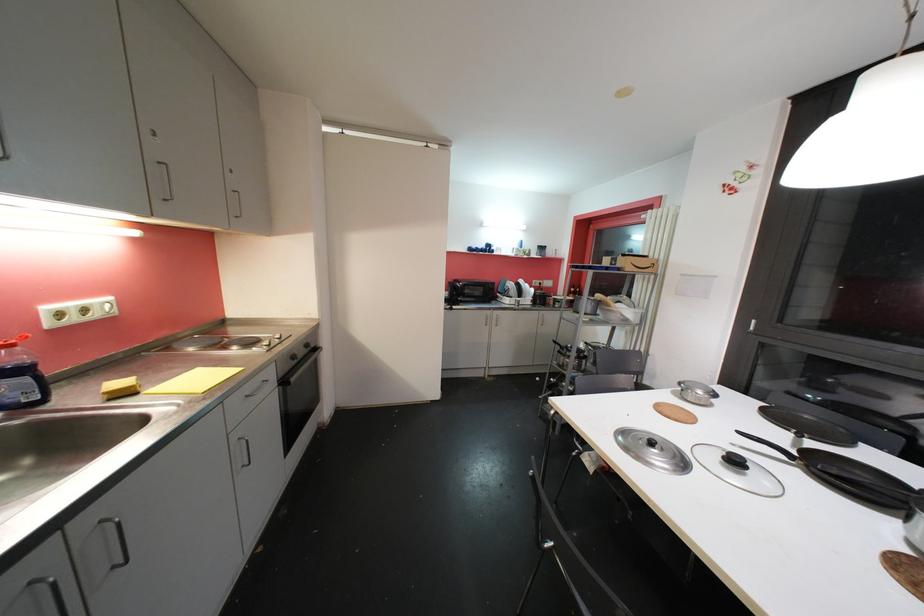
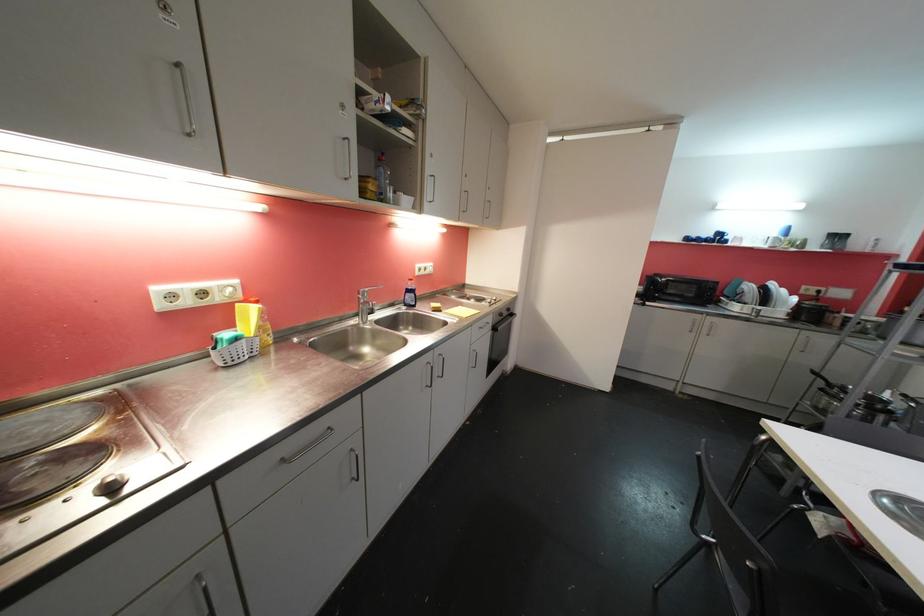
Find the pixel in the second image that matches point (238, 442) in the first image.

(477, 352)